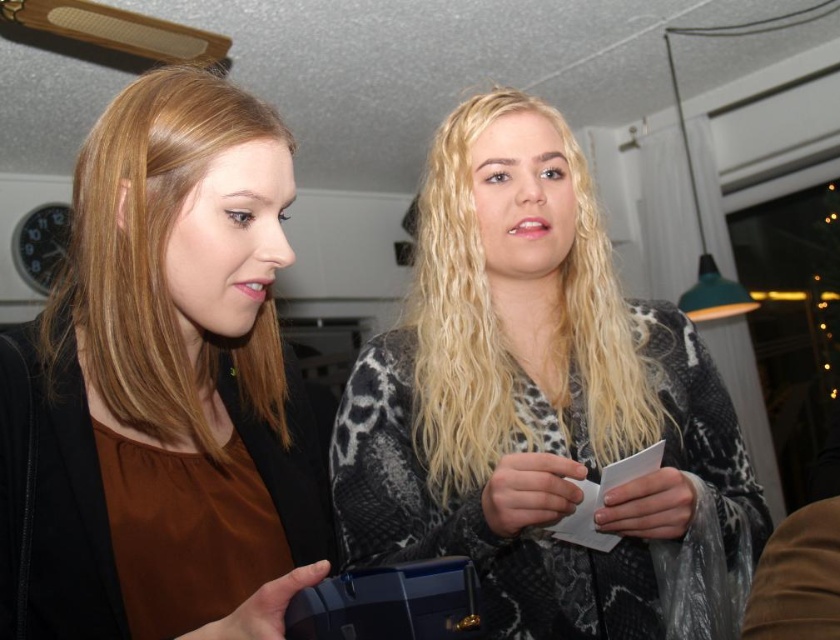
You are standing in the room and want to determine which of the two points, point (265,515) or point (421,252), is nearer to you. Based on the scene, which point is closer?

Point (265,515) is closer to the viewer than point (421,252).

You are designing a new clothing line and need to decide which item to feature in a catalog. Based on the image, which clothing item has a larger size between the leopard print sweater at center and the brown matte shirt at left?

The leopard print sweater at center is bigger than the brown matte shirt at left, so it should be chosen for the catalog if a larger size is preferred.